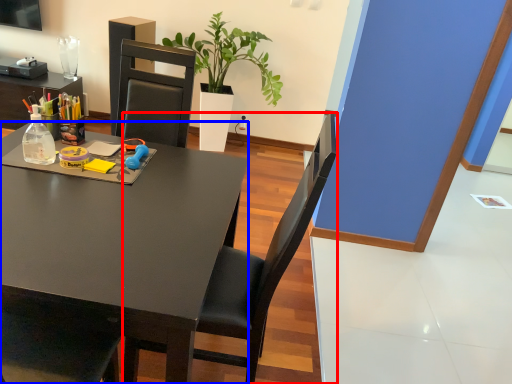
Question: Which object appears farthest to the camera in this image, chair (highlighted by a red box) or desk (highlighted by a blue box)?

Choices:
 (A) chair
 (B) desk

Answer: (A)